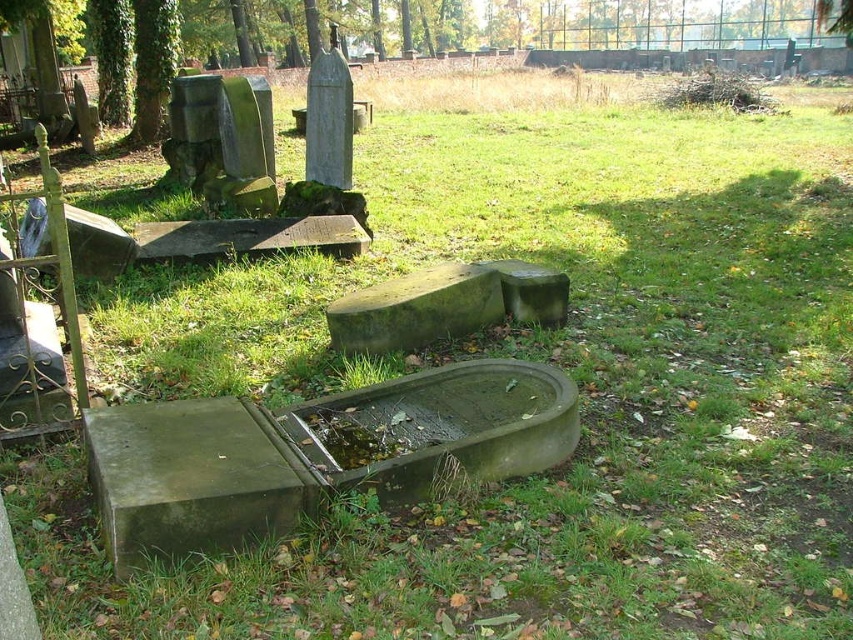
Which is above, green mossy stone at center or green stone gravestone at center?

green stone gravestone at center is above.

Find the location of a particular element. Image resolution: width=853 pixels, height=640 pixels. green mossy stone at center is located at coordinates (415, 308).

Where is `green mossy stone at center`? This screenshot has width=853, height=640. green mossy stone at center is located at coordinates (415, 308).

Is green stone gravestone at lower left in front of green mossy stone at center?

That is True.

Where is `green stone gravestone at lower left`? Image resolution: width=853 pixels, height=640 pixels. green stone gravestone at lower left is located at coordinates (190, 477).

Between point (154, 477) and point (381, 348), which one is positioned behind?

Positioned behind is point (381, 348).

Where is `green stone gravestone at lower left`? green stone gravestone at lower left is located at coordinates (190, 477).

Is green stone gravestone at lower left above green stone gravestone at center?

No, green stone gravestone at lower left is not above green stone gravestone at center.

What do you see at coordinates (190, 477) in the screenshot?
I see `green stone gravestone at lower left` at bounding box center [190, 477].

Where is `green stone gravestone at lower left`? This screenshot has height=640, width=853. green stone gravestone at lower left is located at coordinates (190, 477).